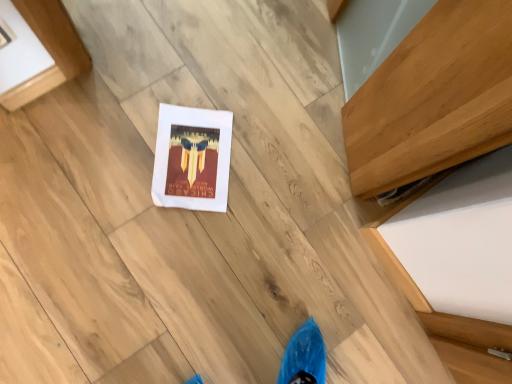
You are a GUI agent. You are given a task and a screenshot of the screen. Output one action in this format:
    pyautogui.click(x=<x>, y=<y>)
    Task: Click on the free area below white paper at center (from a real-world perspective)
    The height and width of the screenshot is (384, 512).
    Given the screenshot: What is the action you would take?
    pyautogui.click(x=192, y=161)